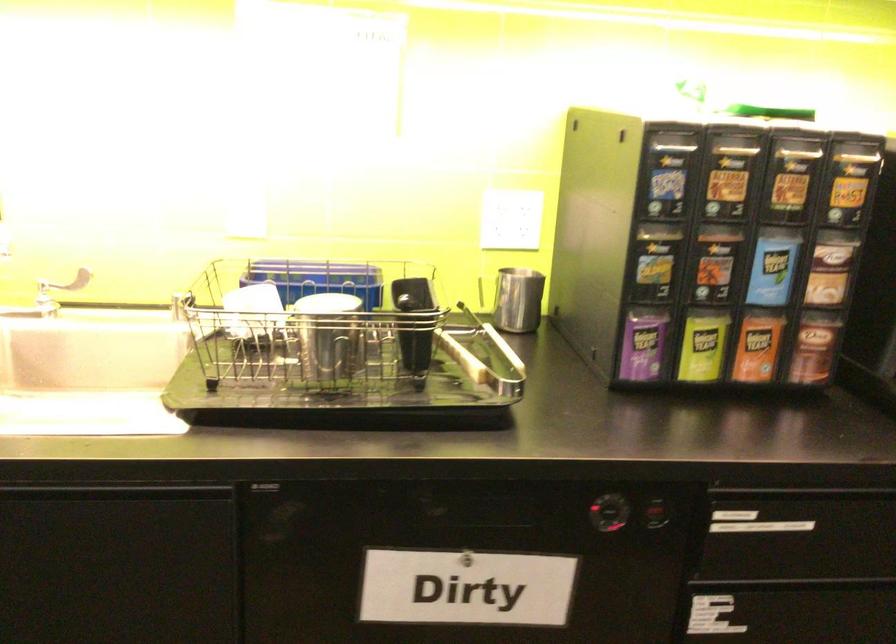
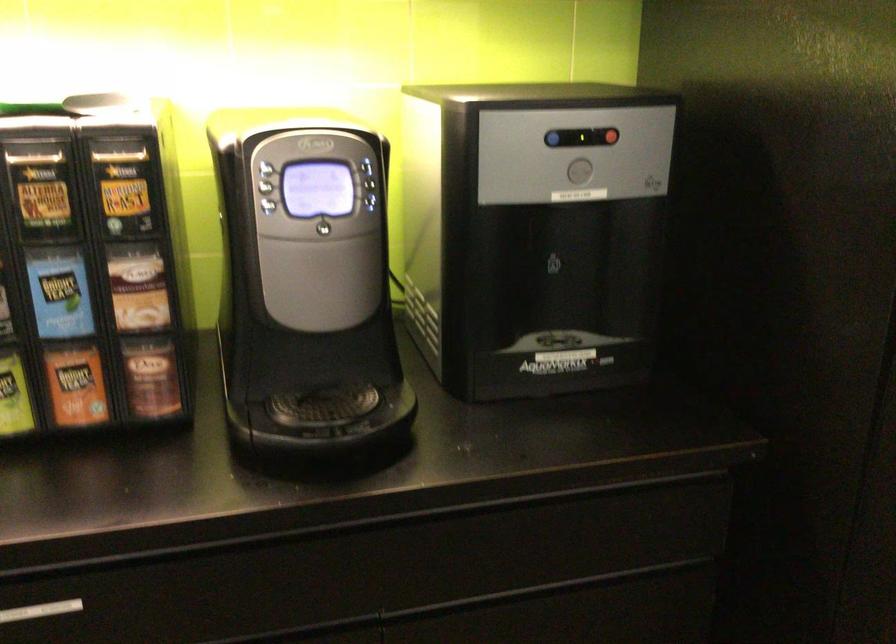
Find the pixel in the second image that matches pixel 777 532 in the first image.

(40, 611)